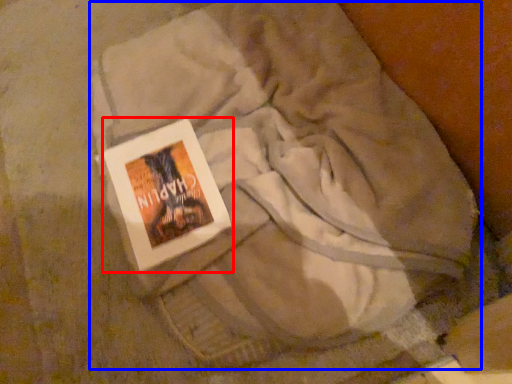
Question: Which object is closer to the camera taking this photo, book (highlighted by a red box) or textile (highlighted by a blue box)?

Choices:
 (A) book
 (B) textile

Answer: (B)